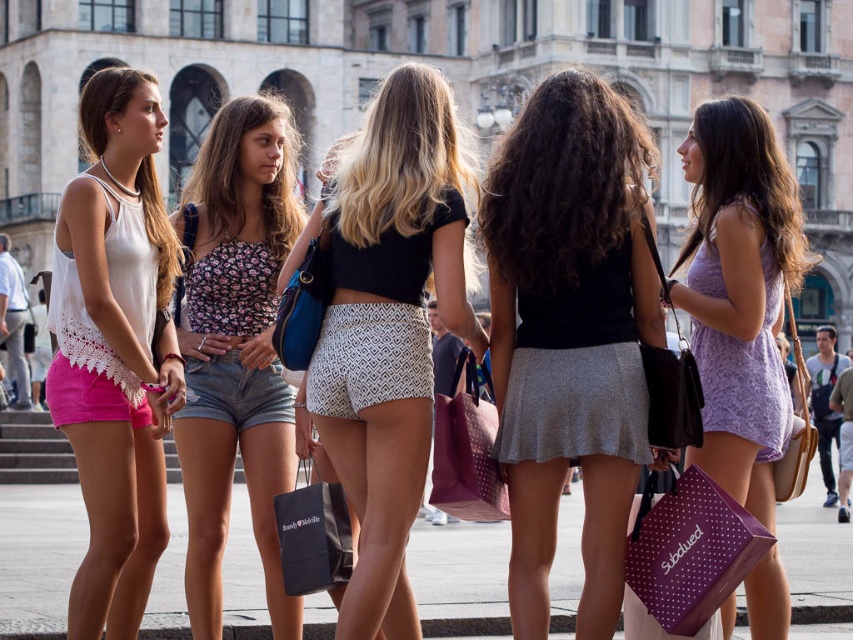
Does black matte tank top at center have a greater width compared to floral fabric dress at center?

In fact, black matte tank top at center might be narrower than floral fabric dress at center.

Who is more forward, (523, 518) or (235, 195)?

Point (523, 518) is more forward.

Where is `black matte tank top at center`? Image resolution: width=853 pixels, height=640 pixels. black matte tank top at center is located at coordinates (570, 333).

Between white textured shorts at center and lavender fabric dress at center, which one appears on the left side from the viewer's perspective?

From the viewer's perspective, white textured shorts at center appears more on the left side.

Between point (392, 602) and point (750, 148), which one is positioned behind?

The point (750, 148) is more distant.

This screenshot has width=853, height=640. What do you see at coordinates (387, 326) in the screenshot?
I see `white textured shorts at center` at bounding box center [387, 326].

Where is `white textured shorts at center`? The image size is (853, 640). white textured shorts at center is located at coordinates (387, 326).

Identify the location of lavender fabric dress at center. This screenshot has width=853, height=640. (746, 182).

Locate an element on the screen. lavender fabric dress at center is located at coordinates pyautogui.click(x=746, y=182).

Image resolution: width=853 pixels, height=640 pixels. I want to click on lavender fabric dress at center, so click(x=746, y=182).